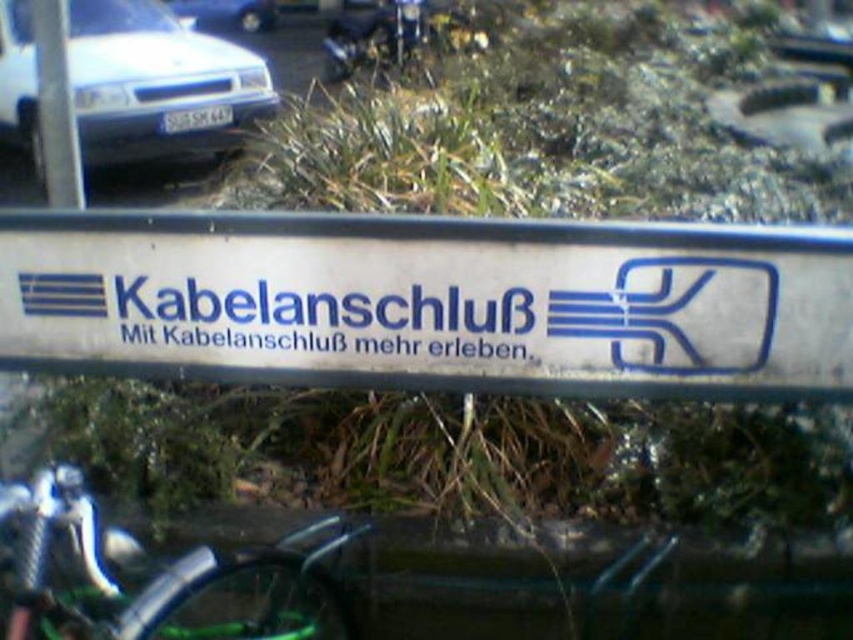
You are a pedestrian standing in front of the scene. You see the white metallic sign at center and the white matte car at upper left. Which object is closer to you?

The white metallic sign at center is closer to you because it is positioned below the white matte car at upper left, indicating it is in a lower spatial position relative to the viewer.

You are a photographer trying to capture both the white metallic sign at center and the white glossy car at upper left in a single shot. Based on their positions, which object will appear larger in your photo?

The white metallic sign at center will appear larger in the photo because it is closer to the viewer than the white glossy car at upper left.

You are standing in front of the white metallic sign at center and want to take a photo of the white matte car at upper left. Since the sign is in the way, can you move to the side to get a clear shot without the sign blocking the car?

The white metallic sign at center is closer to the viewer than the white matte car at upper left, so moving to the side might allow you to position yourself where the sign no longer blocks the view of the car.